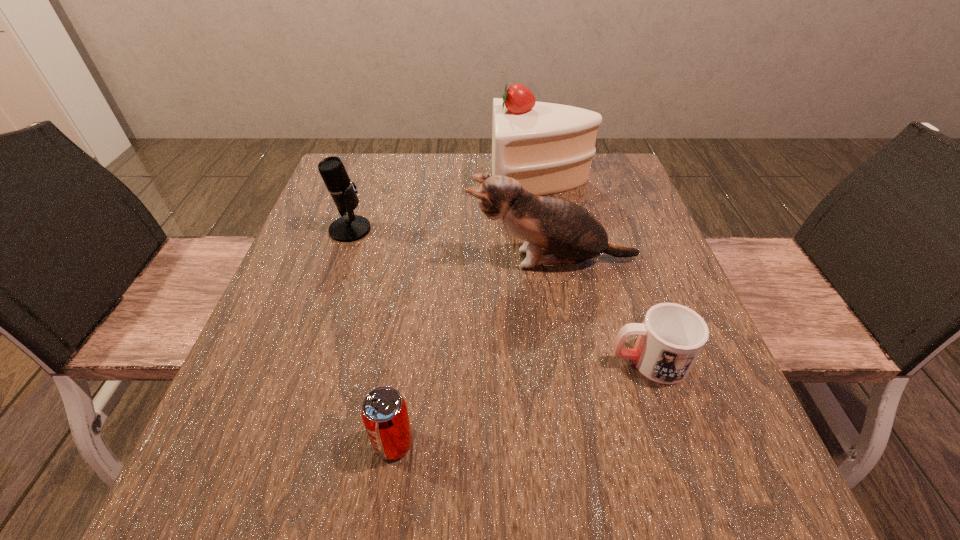
The height and width of the screenshot is (540, 960). I want to click on free region at the near left corner, so click(x=273, y=495).

Image resolution: width=960 pixels, height=540 pixels. I want to click on blank region between the nearest object and the fourth nearest object, so click(372, 336).

Locate an element on the screen. The height and width of the screenshot is (540, 960). empty space between the fourth nearest object and the shortest object is located at coordinates (499, 295).

Where is `free space between the cat and the fourth object from right to left`? Image resolution: width=960 pixels, height=540 pixels. free space between the cat and the fourth object from right to left is located at coordinates (473, 352).

Identify the location of blank region between the farthest object and the mug. (595, 271).

Locate an element on the screen. This screenshot has height=540, width=960. vacant area that lies between the mug and the microphone is located at coordinates (499, 295).

Image resolution: width=960 pixels, height=540 pixels. In order to click on free space that is in between the second farthest object and the cake in this screenshot , I will do `click(445, 205)`.

Find the location of `free point between the mug and the fourth tallest object`. free point between the mug and the fourth tallest object is located at coordinates (521, 402).

This screenshot has height=540, width=960. Find the location of `vacant area between the shortest object and the nearest object`. vacant area between the shortest object and the nearest object is located at coordinates (521, 402).

Identify the location of object that stands as the closest to the tallest object. (556, 231).